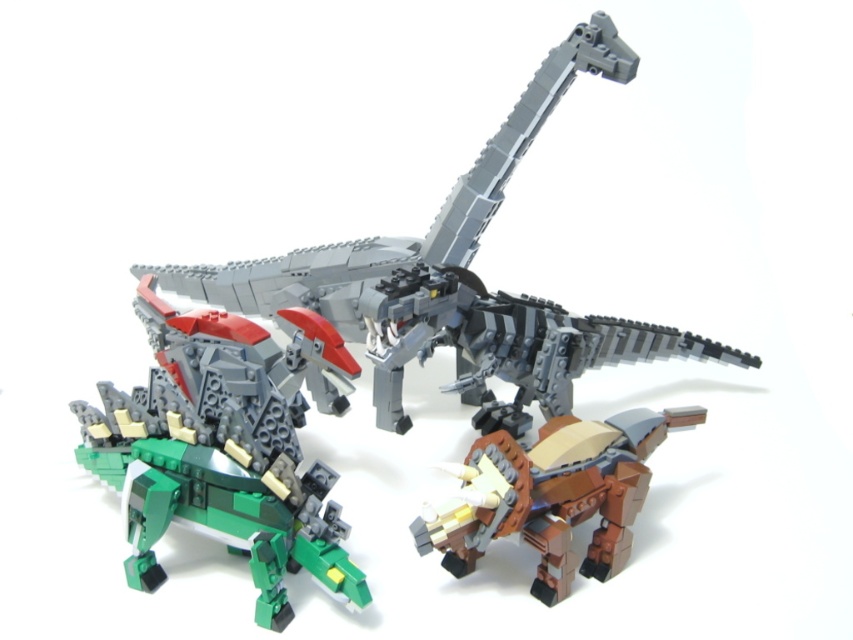
Is point (293, 438) farther from camera compared to point (505, 497)?

Yes, point (293, 438) is behind point (505, 497).

Can you confirm if green matte/brick-like dinosaur at lower left is positioned to the right of brown matte/brick-like triceratops at lower right?

In fact, green matte/brick-like dinosaur at lower left is to the left of brown matte/brick-like triceratops at lower right.

Identify the location of green matte/brick-like dinosaur at lower left. (224, 449).